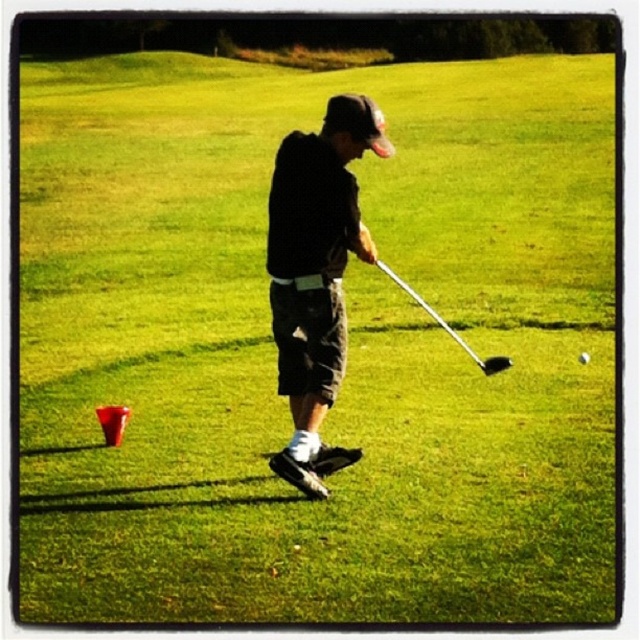
Question: Is metallic silver golf club at center further to camera compared to glossy black golf club at center?

Choices:
 (A) no
 (B) yes

Answer: (A)

Question: Can you confirm if metallic silver golf club at center is positioned to the left of glossy black golf club at center?

Choices:
 (A) no
 (B) yes

Answer: (B)

Question: Is black matte golf club at center below glossy black golf club at center?

Choices:
 (A) no
 (B) yes

Answer: (A)

Question: Among these points, which one is nearest to the camera?

Choices:
 (A) (416, 296)
 (B) (300, 401)

Answer: (B)

Question: Which object is the farthest from the metallic silver golf club at center?

Choices:
 (A) glossy black golf club at center
 (B) black matte golf club at center

Answer: (B)

Question: Which point is farther from the camera taking this photo?

Choices:
 (A) (401, 285)
 (B) (577, 356)
 (C) (339, 362)

Answer: (A)